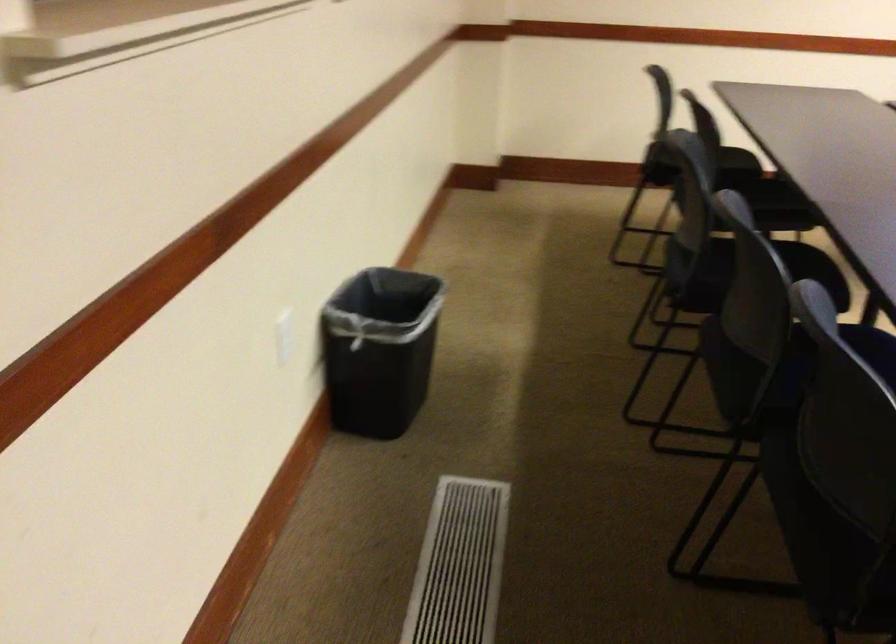
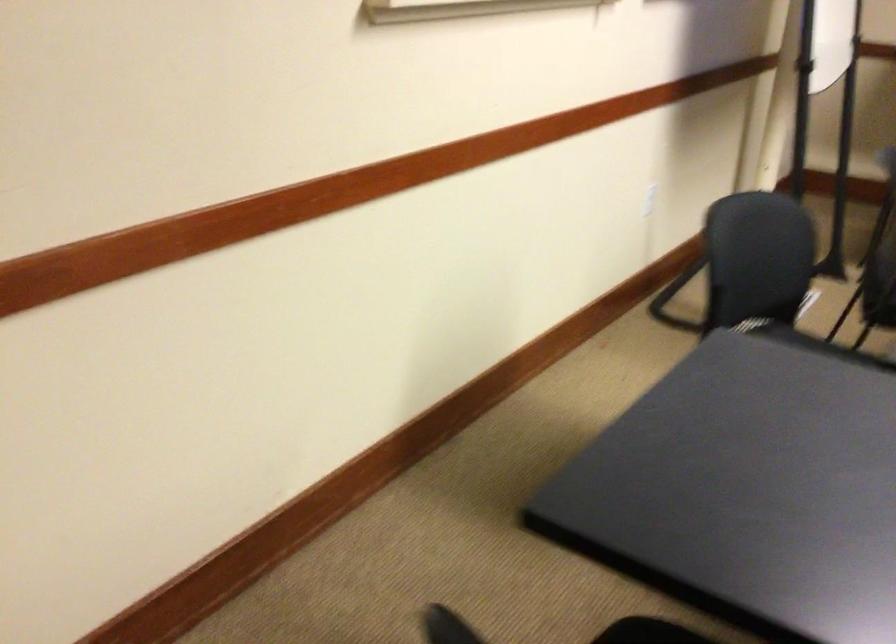
How did the camera likely rotate?

The camera rotated toward right-down.